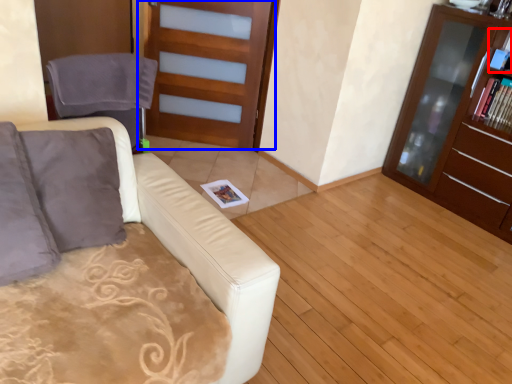
Question: Which object appears closest to the camera in this image, book (highlighted by a red box) or door (highlighted by a blue box)?

Choices:
 (A) book
 (B) door

Answer: (A)